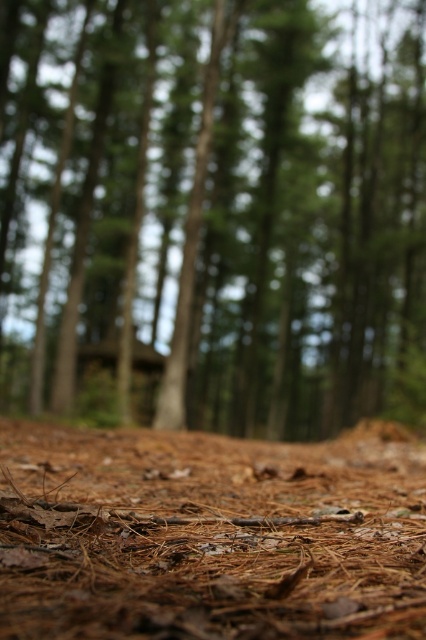
Question: In this image, where is brown textured ground at lower center located relative to brown pine needles at lower center?

Choices:
 (A) right
 (B) left

Answer: (A)

Question: Which point is closer to the camera taking this photo?

Choices:
 (A) (134, 444)
 (B) (400, 77)

Answer: (A)

Question: Which object is farther from the camera taking this photo?

Choices:
 (A) brown pine needles at lower center
 (B) brown textured ground at lower center

Answer: (B)

Question: Can you confirm if brown textured ground at lower center is smaller than brown pine needles at lower center?

Choices:
 (A) no
 (B) yes

Answer: (A)

Question: Can you confirm if brown textured ground at lower center is thinner than brown pine needles at lower center?

Choices:
 (A) yes
 (B) no

Answer: (B)